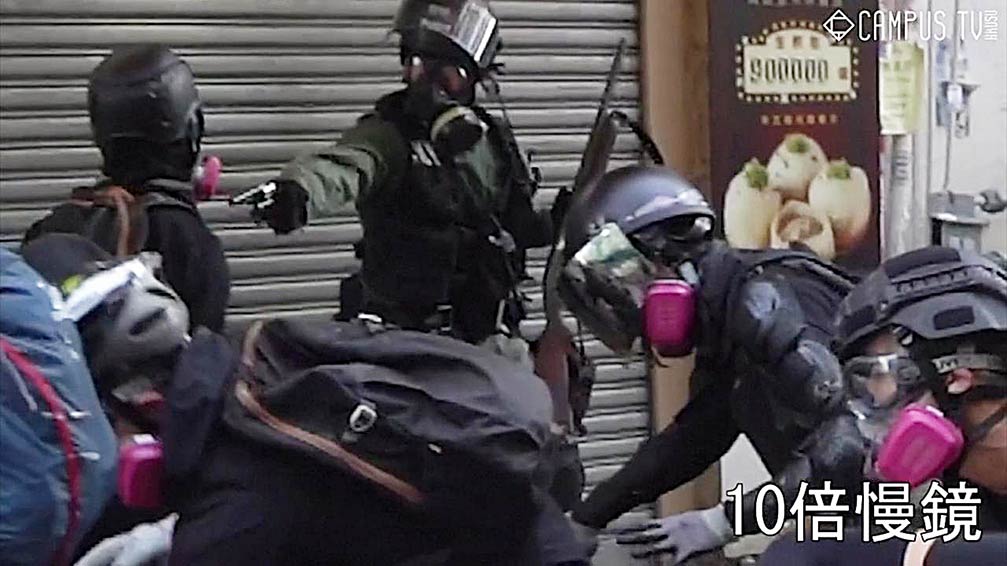
Identify the location of glass. The image size is (1007, 566). (458, 25).